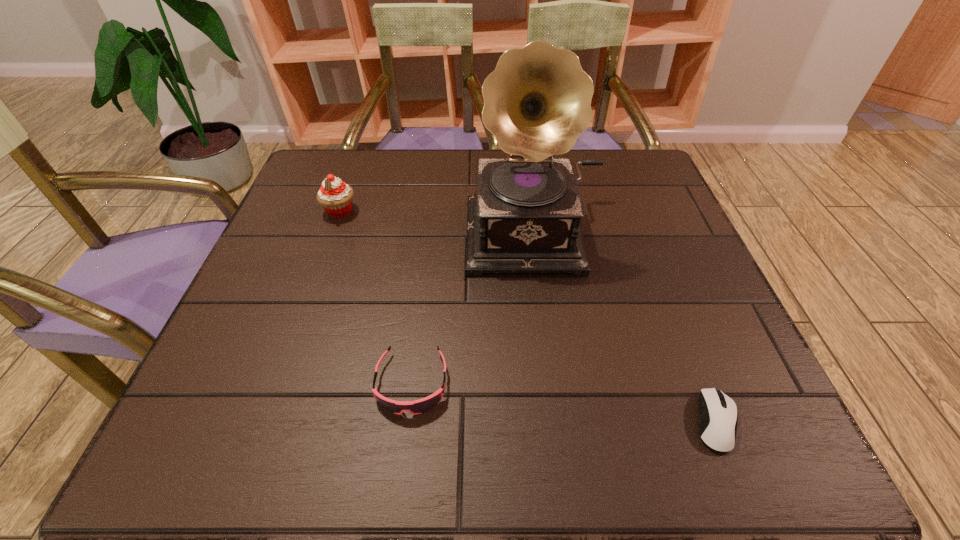
Find the location of a particular element. This screenshot has width=960, height=540. blank region between the leftmost object and the shortest object is located at coordinates (528, 317).

You are a GUI agent. You are given a task and a screenshot of the screen. Output one action in this format:
    pyautogui.click(x=<x>, y=<y>)
    Task: Click on the free space between the shortest object and the goggles
    
    Given the screenshot: What is the action you would take?
    pyautogui.click(x=564, y=403)

In order to click on vacant point located between the shortest object and the third object from right to left in this screenshot , I will do `click(564, 403)`.

Locate an element on the screen. object that is the second closest to the shortest object is located at coordinates (x=420, y=406).

Locate an element on the screen. The height and width of the screenshot is (540, 960). the second closest object relative to the goggles is located at coordinates (335, 196).

Where is `free spot that satisfies the following two spatial constraints: 1. on the front-facing side of the goggles; 2. on the left side of the mouse`? The image size is (960, 540). free spot that satisfies the following two spatial constraints: 1. on the front-facing side of the goggles; 2. on the left side of the mouse is located at coordinates (407, 422).

This screenshot has width=960, height=540. I want to click on vacant region that satisfies the following two spatial constraints: 1. on the horn of the third object from left to right; 2. on the left side of the mouse, so click(562, 422).

I want to click on vacant space that satisfies the following two spatial constraints: 1. on the horn of the rightmost object; 2. on the right side of the tallest object, so click(562, 422).